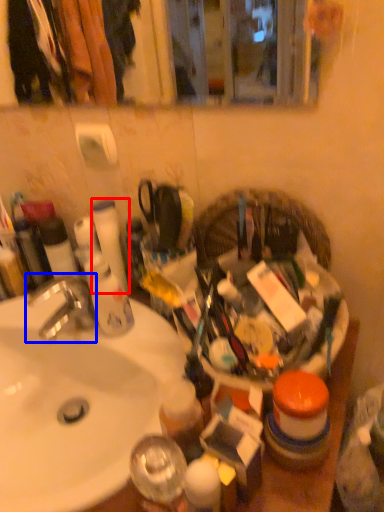
Question: Which point is further to the camera, toilet paper (highlighted by a red box) or faucet (highlighted by a blue box)?

Choices:
 (A) toilet paper
 (B) faucet

Answer: (A)